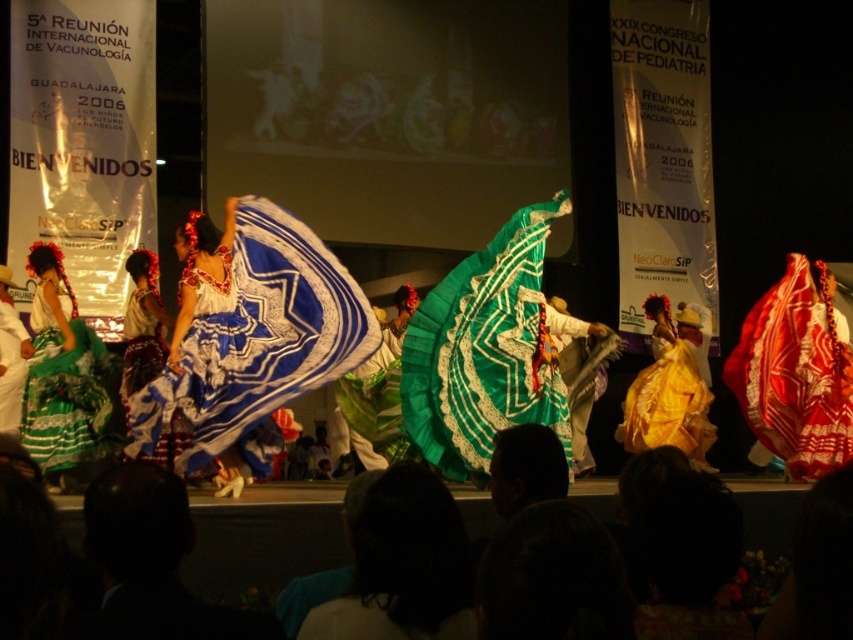
Question: Which point is farther to the camera?

Choices:
 (A) (142, 276)
 (B) (538, 465)

Answer: (A)

Question: Does dark hair at lower center have a lesser width compared to green lace dress at left?

Choices:
 (A) yes
 (B) no

Answer: (B)

Question: Observing the image, what is the correct spatial positioning of dark hair at lower center in reference to yellow satin dress at center?

Choices:
 (A) below
 (B) above

Answer: (A)

Question: Which object is positioned farthest from the yellow satin dress at center?

Choices:
 (A) dark hair at lower center
 (B) green lace dress at left

Answer: (B)

Question: Which of the following is the farthest from the observer?

Choices:
 (A) (33, 390)
 (B) (396, 600)
 (C) (688, 308)
 (D) (520, 424)

Answer: (C)

Question: Is dark hair at lower center wider than matte blue fabric dress at center?

Choices:
 (A) no
 (B) yes

Answer: (B)